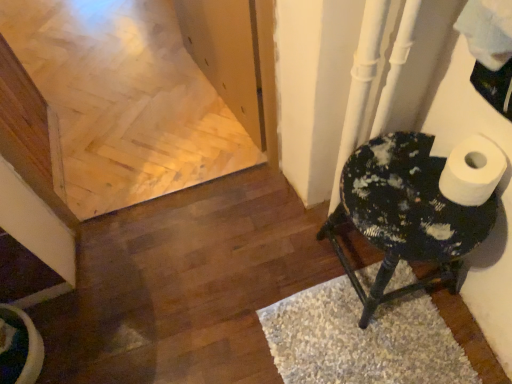
Where is `blank space situated above white shaggy rug at lower right (from a real-world perspective)`? blank space situated above white shaggy rug at lower right (from a real-world perspective) is located at coordinates (369, 340).